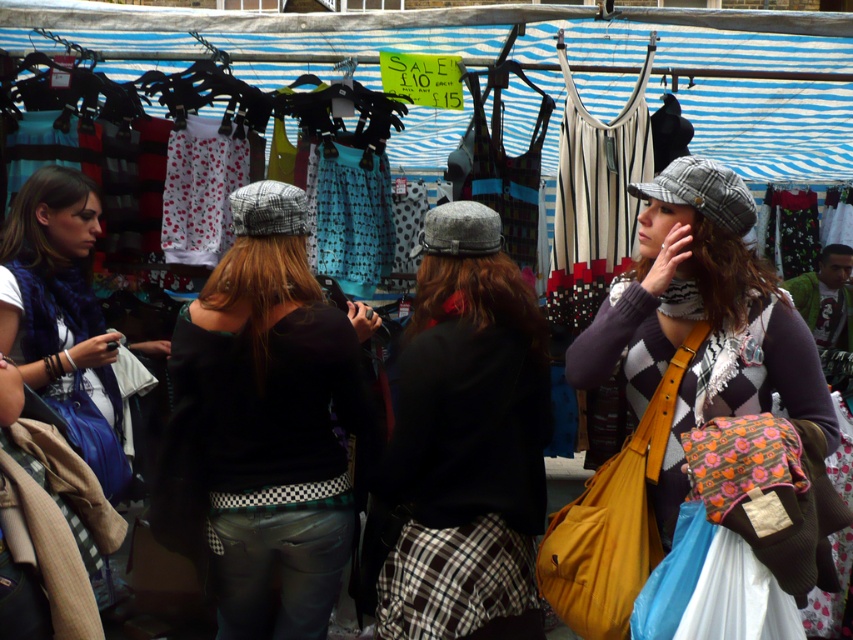
You are a customer at the market and want to pick up both the black woolen sweater at center and the plaid wool cap at center. How far apart are they?

The black woolen sweater at center and the plaid wool cap at center are 23.62 inches apart.

You are a customer at the market and want to buy both the black woolen sweater at center and the plaid wool cap at center. Which item is smaller in size?

The black woolen sweater at center has a smaller size compared to the plaid wool cap at center, so the black woolen sweater at center is the smaller item.

You are a customer at the market stall under the blue and white striped canopy. You see the black checkered belt at center and the plaid wool cap at center. Which item is positioned lower?

The black checkered belt at center is below the plaid wool cap at center, so the black checkered belt at center is positioned lower.